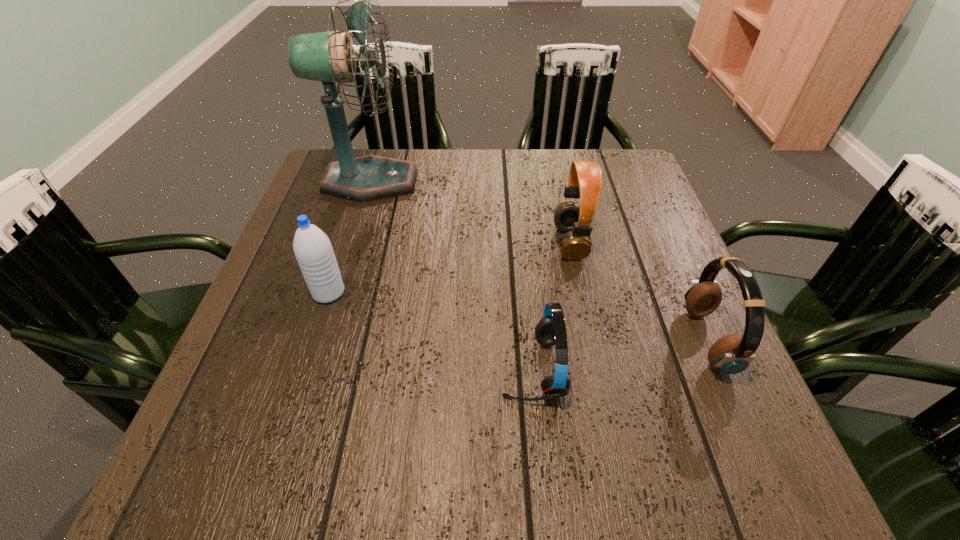
You are a GUI agent. You are given a task and a screenshot of the screen. Output one action in this format:
    pyautogui.click(x=<x>, y=<y>)
    Task: Click on the vacant space at the far right corner
    
    Given the screenshot: What is the action you would take?
    pyautogui.click(x=607, y=195)

You are a GUI agent. You are given a task and a screenshot of the screen. Output one action in this format:
    pyautogui.click(x=<x>, y=<y>)
    Task: Click on the empty space between the rightmost headset and the tallest object
    
    Given the screenshot: What is the action you would take?
    pyautogui.click(x=539, y=261)

Where is `empty space between the fourth nearest object and the rightmost headset`? The width and height of the screenshot is (960, 540). empty space between the fourth nearest object and the rightmost headset is located at coordinates (638, 292).

Find the location of a particular element. The width and height of the screenshot is (960, 540). vacant area that lies between the rightmost headset and the fourth nearest object is located at coordinates (638, 292).

Identify the location of free space between the water bottle and the rightmost headset. (517, 316).

Where is `empty space that is in between the farthest object and the farthest headset`? The width and height of the screenshot is (960, 540). empty space that is in between the farthest object and the farthest headset is located at coordinates pyautogui.click(x=470, y=212).

Identify the location of vacant space in between the rightmost object and the third object from left to right. (619, 354).

Identify the location of empty location between the farthest object and the second headset from right to left. (470, 212).

This screenshot has width=960, height=540. Find the location of `free space between the shortest headset and the farthest object`. free space between the shortest headset and the farthest object is located at coordinates [x=451, y=275].

The image size is (960, 540). I want to click on empty location between the farthest object and the water bottle, so click(349, 237).